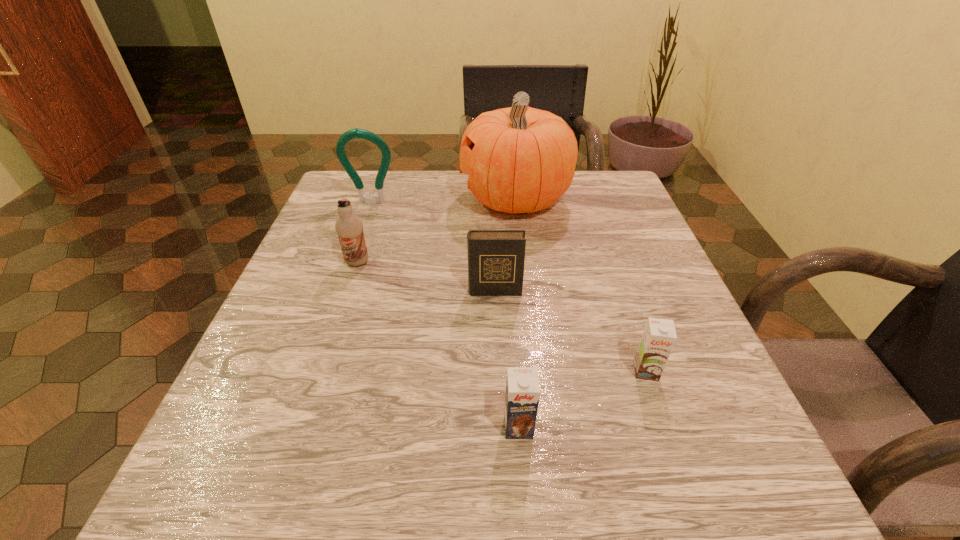
I want to click on vacant space located 0.190m on the front-facing side of the pumpkin, so point(381,199).

The image size is (960, 540). I want to click on blank space located on the front-facing side of the pumpkin, so click(x=385, y=199).

Identify the location of vacant space located at the jaws of the second tallest object. (366, 220).

The width and height of the screenshot is (960, 540). I want to click on blank space located on the front of the farthest chocolate milk, so click(332, 338).

Where is `vacant space located 0.190m on the front cover of the diary`? vacant space located 0.190m on the front cover of the diary is located at coordinates (498, 384).

Where is `free point located 0.170m on the left of the second nearest chocolate milk`? free point located 0.170m on the left of the second nearest chocolate milk is located at coordinates (522, 371).

Where is `pumpkin that is at the far edge`? pumpkin that is at the far edge is located at coordinates (519, 159).

Locate an element on the screen. Image resolution: width=960 pixels, height=540 pixels. bottle opener present at the far edge is located at coordinates (357, 133).

Identify the location of bottle opener located at the left edge. The width and height of the screenshot is (960, 540). (357, 133).

Find the location of a particular element. chocolate milk situated at the left edge is located at coordinates (349, 227).